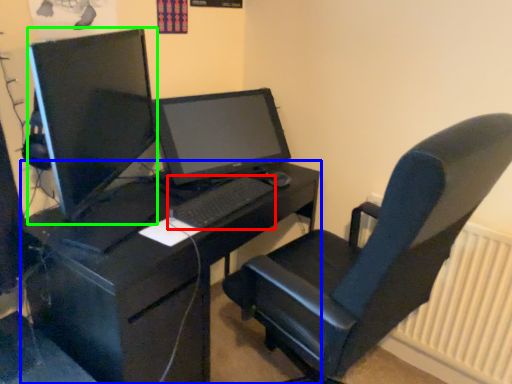
Question: Estimate the real-world distances between objects in this image. Which object is farther from computer keyboard (highlighted by a red box), desk (highlighted by a blue box) or computer monitor (highlighted by a green box)?

Choices:
 (A) desk
 (B) computer monitor

Answer: (B)